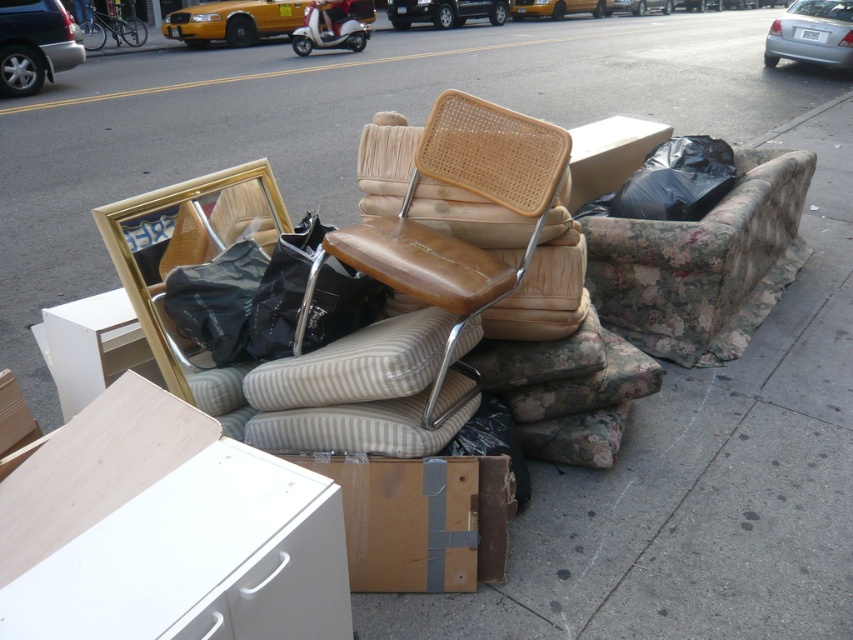
Which of these two, brown cardboard box at lower center or black plastic bag at upper right, stands taller?

With more height is black plastic bag at upper right.

Does brown cardboard box at lower center lie in front of black plastic bag at upper right?

Yes, brown cardboard box at lower center is in front of black plastic bag at upper right.

Where is `brown cardboard box at lower center`? brown cardboard box at lower center is located at coordinates (421, 518).

Between floral fabric couch at center and brown leather swivel chair at center, which one has more height?

floral fabric couch at center

Is floral fabric couch at center to the left of brown leather swivel chair at center from the viewer's perspective?

In fact, floral fabric couch at center is to the right of brown leather swivel chair at center.

Where is `floral fabric couch at center`? The width and height of the screenshot is (853, 640). floral fabric couch at center is located at coordinates (701, 262).

Locate an element on the screen. floral fabric couch at center is located at coordinates (701, 262).

Who is positioned more to the left, brown leather swivel chair at center or brown cardboard box at lower center?

Positioned to the left is brown cardboard box at lower center.

Which is in front, point (421, 248) or point (349, 477)?

Point (349, 477) is more forward.

Where is `brown leather swivel chair at center`? The height and width of the screenshot is (640, 853). brown leather swivel chair at center is located at coordinates (450, 236).